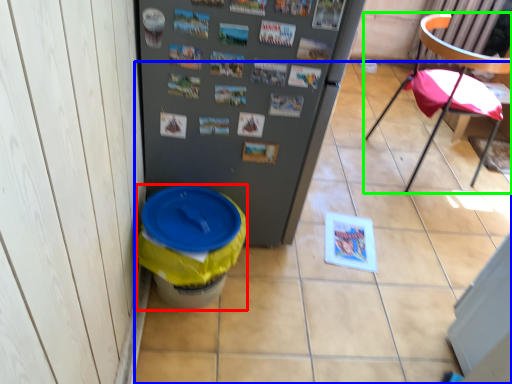
Question: Considering the real-world distances, which object is farthest from potty (highlighted by a red box)? tile (highlighted by a blue box) or chair (highlighted by a green box)?

Choices:
 (A) tile
 (B) chair

Answer: (B)